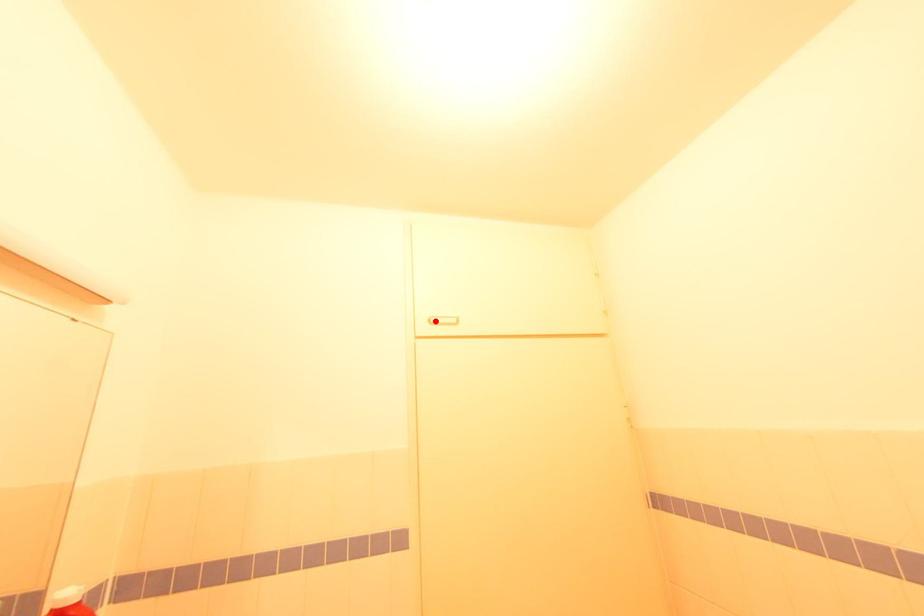
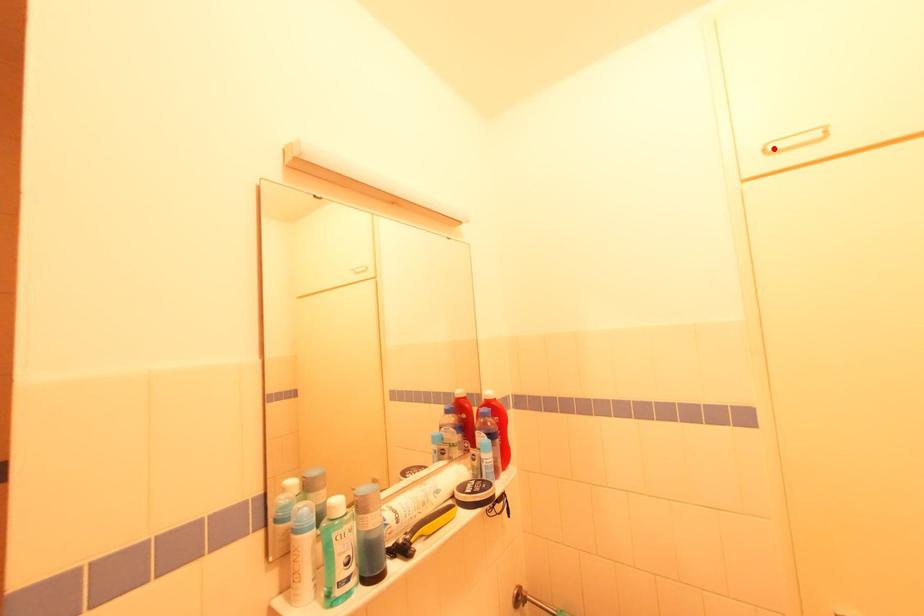
I am providing you with two images of the same scene from different viewpoints. A red point is marked on the first image and another point is marked on the second image. Does the point marked in image1 correspond to the same location as the one in image2?

Yes